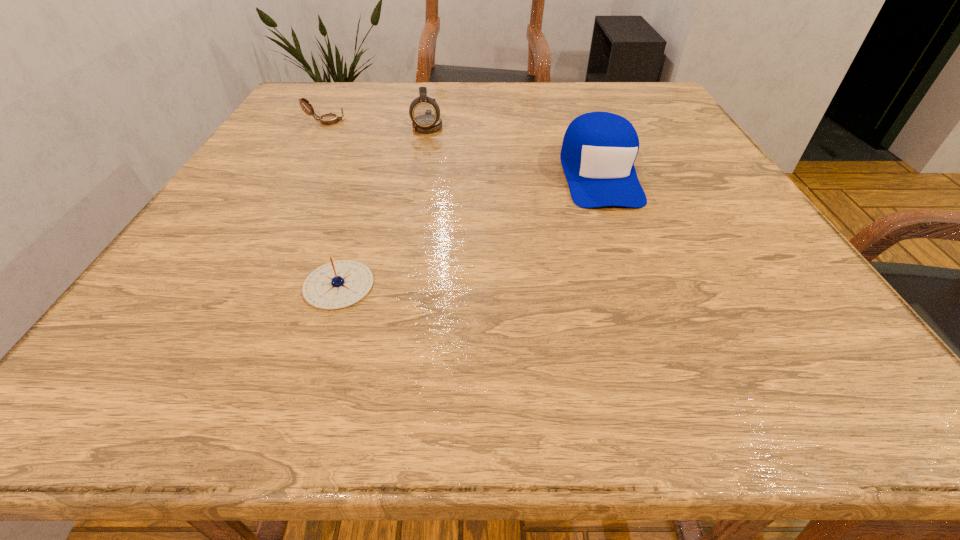
Find the location of `vacant space in between the nearest compass and the leftmost compass`. vacant space in between the nearest compass and the leftmost compass is located at coordinates (332, 203).

Where is `vacant area that lies between the second compass from right to left and the leftmost object`? vacant area that lies between the second compass from right to left and the leftmost object is located at coordinates (332, 203).

Image resolution: width=960 pixels, height=540 pixels. In order to click on free space between the baseball cap and the leftmost compass in this screenshot , I will do [x=463, y=148].

Where is `unoccupied position between the tallest compass and the second compass from left to right`? The width and height of the screenshot is (960, 540). unoccupied position between the tallest compass and the second compass from left to right is located at coordinates (383, 205).

In order to click on empty location between the rightmost compass and the third object from right to left in this screenshot , I will do `click(383, 205)`.

You are a GUI agent. You are given a task and a screenshot of the screen. Output one action in this format:
    pyautogui.click(x=<x>, y=<y>)
    Task: Click on the blank region between the leftmost compass and the second object from left to right
    This screenshot has height=540, width=960.
    Given the screenshot: What is the action you would take?
    pyautogui.click(x=332, y=203)

What are the coordinates of `free spot between the tallest compass and the baseball cap` in the screenshot? It's located at (514, 150).

Identify the location of empty space between the leftmost object and the tallest compass. (377, 123).

Where is `free space between the nearest compass and the leftmost object`? The width and height of the screenshot is (960, 540). free space between the nearest compass and the leftmost object is located at coordinates (332, 203).

Locate an element on the screen. This screenshot has width=960, height=540. free space between the rightmost compass and the rightmost object is located at coordinates (514, 150).